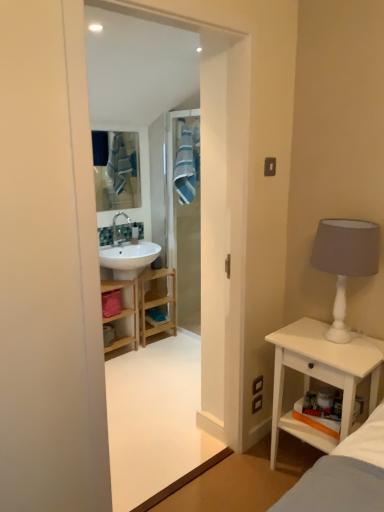
At what (x,y) coordinates should I click in order to perform the action: click on vacant region above white wood nightstand at right (from a real-world perspective). Please return your answer as a coordinate pair (x, y). Looking at the image, I should click on (323, 340).